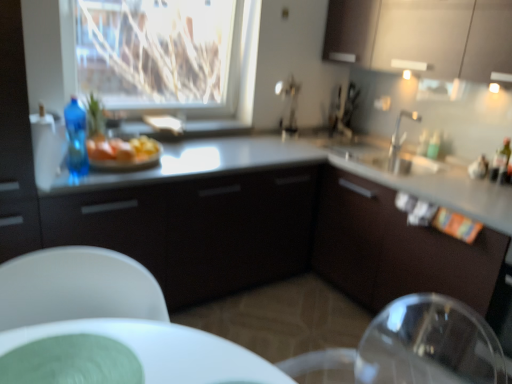
Identify the location of blank space above green matte plate at lower left (from a real-world perspective). This screenshot has height=384, width=512. (64, 362).